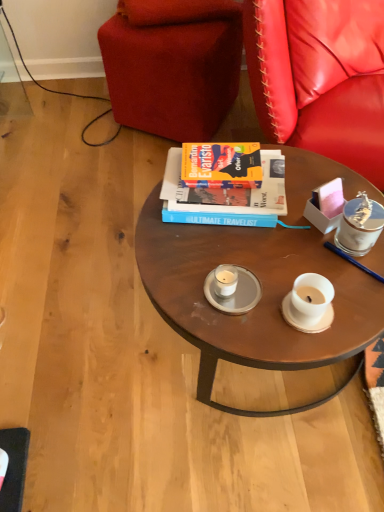
You are a GUI agent. You are given a task and a screenshot of the screen. Output one action in this format:
    pyautogui.click(x=<x>, y=<y>)
    Task: Click on the vacant space that's between hardcover book at center and silver metallic candle at upper right, the first coffee cup when ordered from top to bottom
    
    Given the screenshot: What is the action you would take?
    pyautogui.click(x=287, y=222)